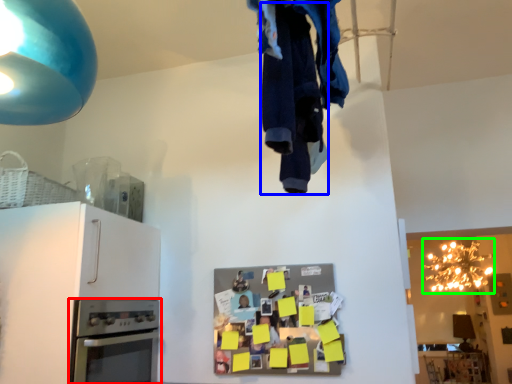
Question: Estimate the real-world distances between objects in this image. Which object is closer to home appliance (highlighted by a red box), clothing (highlighted by a blue box) or lamp (highlighted by a green box)?

Choices:
 (A) clothing
 (B) lamp

Answer: (A)